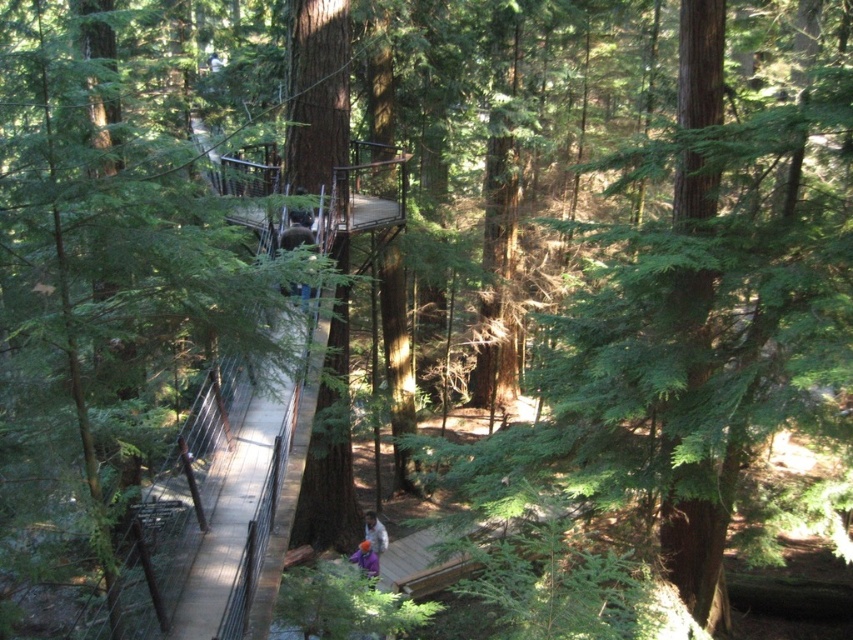
You are a hiker who wants to carry both the white cotton shirt at lower center and the purple fabric at center in your backpack. The backpack has a width limit of 1 meter. Which item can fit without exceeding the width limit?

The white cotton shirt at lower center has a width less than the purple fabric at center, so the white cotton shirt at lower center can fit within the backpack width limit of 1 meter, but the purple fabric at center might exceed it.

You are standing on the wooden walkway in the forest and see a point marked at coordinates (375, 532). What object is located at that point?

The white cotton shirt at lower center is located at point (375, 532).

You are standing on the treehouse platform and notice a white cotton shirt at lower center. Where exactly is the white cotton shirt located in relation to your current position?

The white cotton shirt at lower center is located at coordinates point (375, 532).